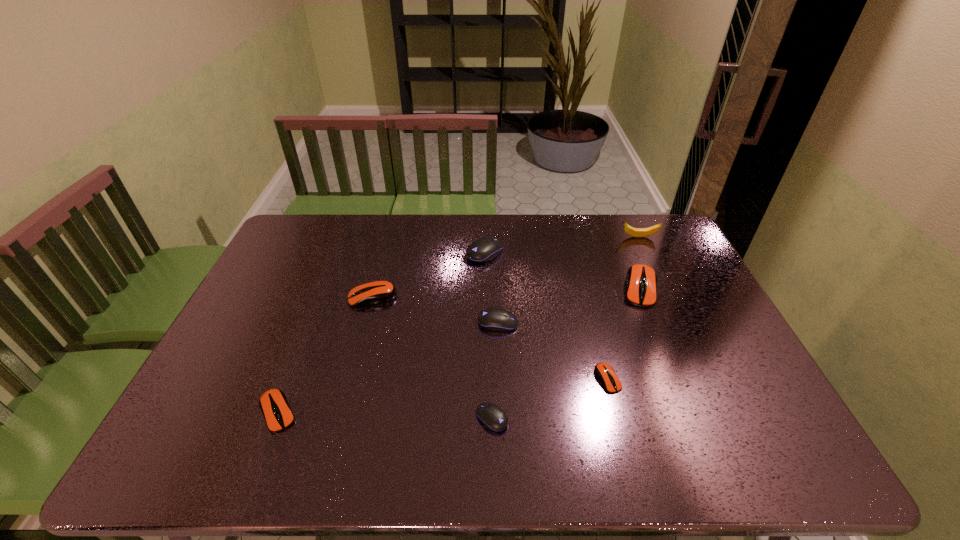
You are a GUI agent. You are given a task and a screenshot of the screen. Output one action in this format:
    pyautogui.click(x=<x>, y=<y>)
    Task: Click on the leftmost computer mouse
    The image size is (960, 540).
    Given the screenshot: What is the action you would take?
    pyautogui.click(x=273, y=403)

Locate an element on the screen. The width and height of the screenshot is (960, 540). the second smallest orange computer mouse is located at coordinates (273, 403).

Where is `the nearest black computer mouse`? the nearest black computer mouse is located at coordinates (493, 417).

The image size is (960, 540). Identify the location of the third orange computer mouse from left to right. (605, 373).

I want to click on the sixth object from left to right, so click(x=605, y=373).

Locate an element on the screen. The width and height of the screenshot is (960, 540). free space located at the stem of the yellow banana is located at coordinates (540, 237).

The height and width of the screenshot is (540, 960). Identify the location of free space located 0.260m at the stem of the yellow banana. (548, 237).

You are a GUI agent. You are given a task and a screenshot of the screen. Output one action in this format:
    pyautogui.click(x=<x>, y=<y>)
    Task: Click on the free point located 0.350m at the stem of the yellow banana
    The width and height of the screenshot is (960, 540).
    Given the screenshot: What is the action you would take?
    pyautogui.click(x=523, y=237)

Identify the location of free space located 0.250m on the left of the biggest orange computer mouse. (542, 288).

The height and width of the screenshot is (540, 960). Identify the location of vacant space located 0.180m on the front of the biggest black computer mouse. pyautogui.click(x=486, y=302).